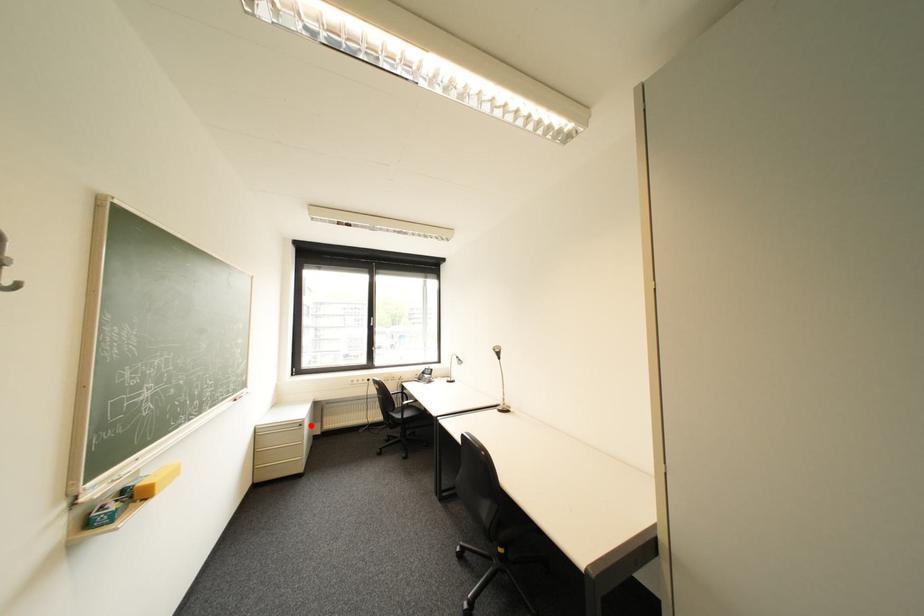
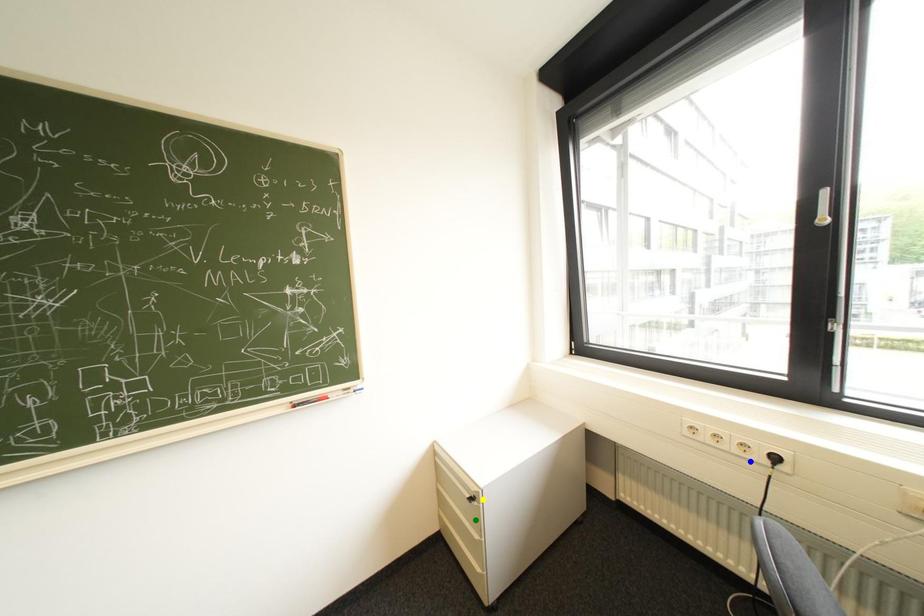
Question: I am providing you with two images of the same scene from different viewpoints. A red point is marked on the first image. You are given multiple points on the second image. Which point in image 2 is actually the same real-world point as the red point in image 1?

Choices:
 (A) yellow point
 (B) blue point
 (C) green point

Answer: (A)